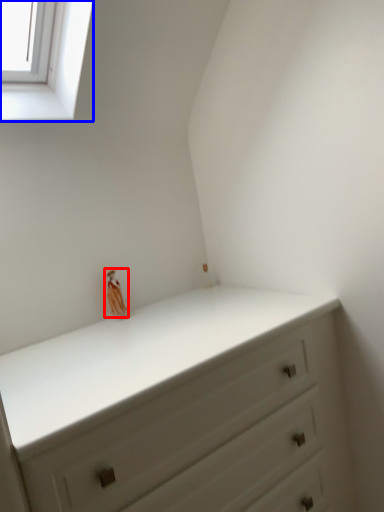
Question: Which object appears farthest to the camera in this image, miniature (highlighted by a red box) or window (highlighted by a blue box)?

Choices:
 (A) miniature
 (B) window

Answer: (A)